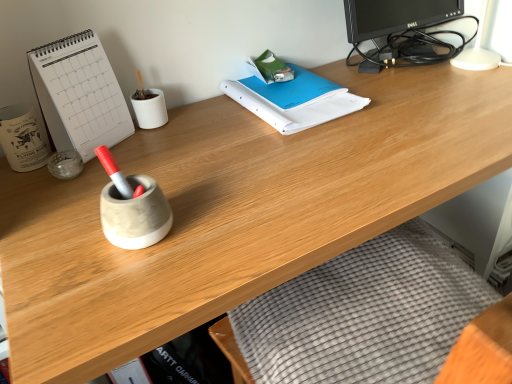
Question: In terms of size, does white paper at left appear bigger or smaller than blue paper binder at center?

Choices:
 (A) small
 (B) big

Answer: (B)

Question: Does point (102, 99) appear closer or farther from the camera than point (348, 99)?

Choices:
 (A) farther
 (B) closer

Answer: (B)

Question: Which is nearer to the black glossy monitor at upper right?

Choices:
 (A) transparent glass jar at left, which appears as the second stationery when viewed from the left
 (B) white paper at left
 (C) blue paper binder at center
 (D) white ceramic mug at left, which appears as the second stationery when viewed from the right

Answer: (C)

Question: Which of these objects is positioned closest to the white ceramic mug at left, which appears as the second stationery when viewed from the right?

Choices:
 (A) transparent glass jar at left, which appears as the second stationery when viewed from the left
 (B) white paper at left
 (C) blue paper binder at center
 (D) black glossy monitor at upper right

Answer: (A)